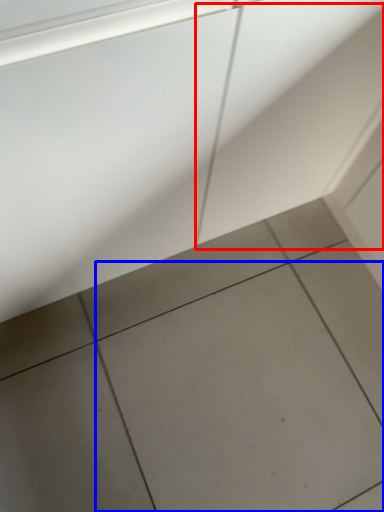
Question: Which object appears farthest to the camera in this image, concrete (highlighted by a red box) or ceramic tile (highlighted by a blue box)?

Choices:
 (A) concrete
 (B) ceramic tile

Answer: (B)